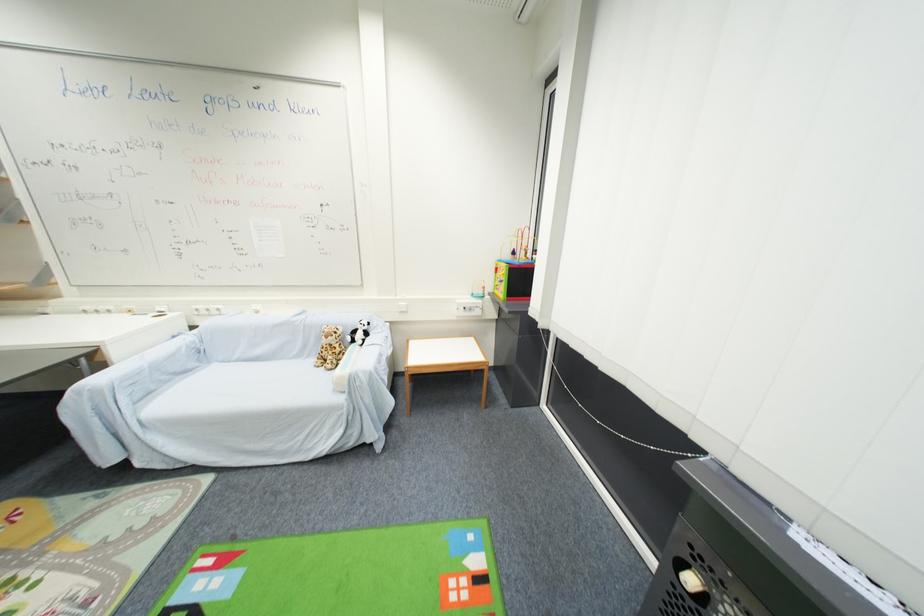
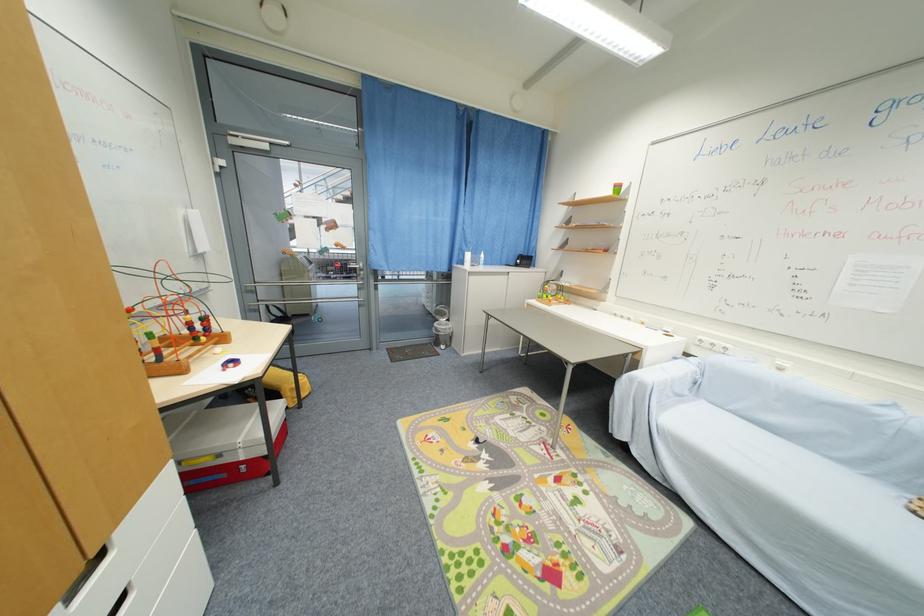
Where in the second image is the point corresponding to the point at 202,312 from the first image?

(706, 342)